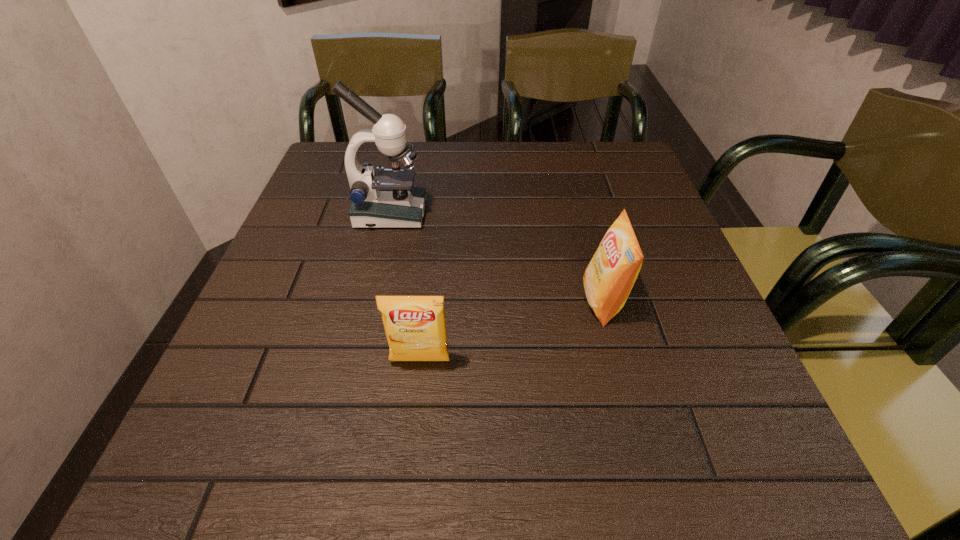
Find the location of a particular element. The width and height of the screenshot is (960, 540). the farthest object is located at coordinates (386, 198).

What are the coordinates of `microscope` in the screenshot? It's located at (386, 198).

This screenshot has width=960, height=540. In order to click on the farther crisp (potato chip) in this screenshot , I will do `click(609, 277)`.

Identify the location of the rightmost object. pos(609,277).

Where is `the left crisp (potato chip)`? the left crisp (potato chip) is located at coordinates (415, 326).

I want to click on the nearer crisp (potato chip), so click(x=415, y=326).

Find the location of a particular element. This screenshot has width=960, height=540. vacant space located at the eyepiece of the tallest object is located at coordinates (514, 214).

I want to click on free point located on the front-facing side of the rightmost object, so click(490, 301).

This screenshot has height=540, width=960. I want to click on vacant space located on the front-facing side of the rightmost object, so click(490, 301).

Where is `vacant region located 0.130m on the front-facing side of the rightmost object`? vacant region located 0.130m on the front-facing side of the rightmost object is located at coordinates (516, 301).